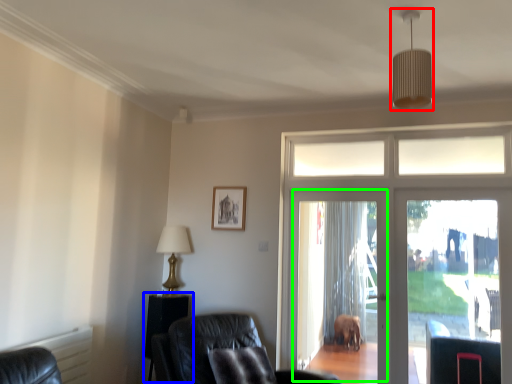
Question: Which object is positioned closest to light fixture (highlighted by a red box)? Select from side table (highlighted by a blue box) and screen door (highlighted by a green box).

Choices:
 (A) side table
 (B) screen door

Answer: (B)